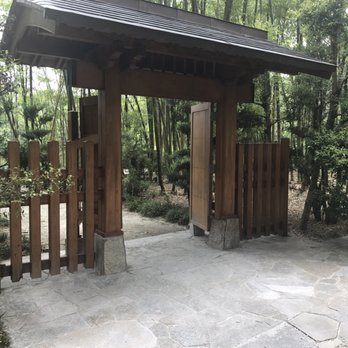
This screenshot has height=348, width=348. I want to click on doors, so click(201, 145), click(90, 114).